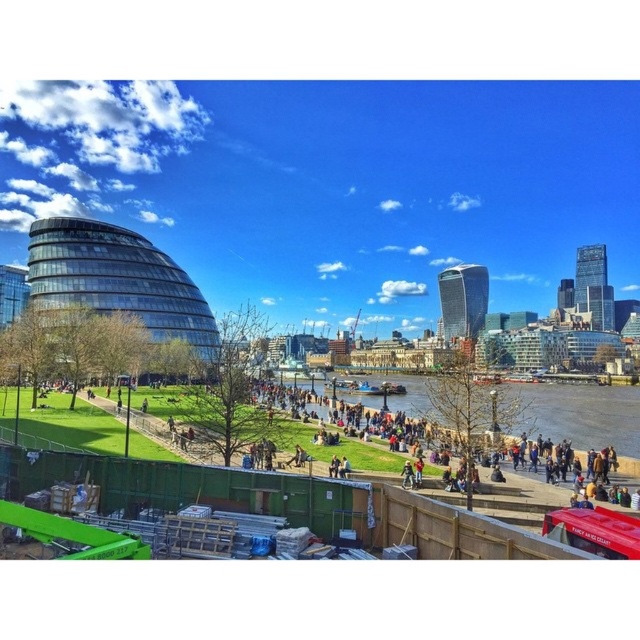
This screenshot has width=640, height=640. What do you see at coordinates (288, 500) in the screenshot?
I see `green grass at lower center` at bounding box center [288, 500].

Is point (419, 515) farther from camera compared to point (618, 456)?

No, it is in front of (618, 456).

The image size is (640, 640). I want to click on green grass at lower center, so [288, 500].